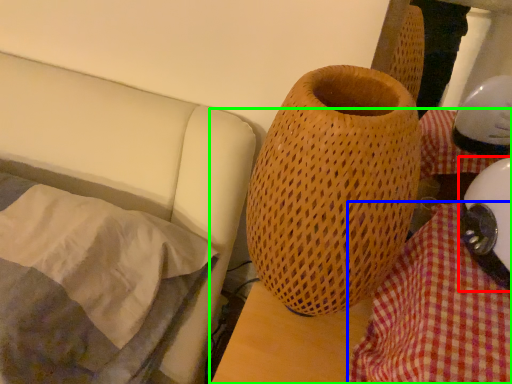
Question: Which object is positioned closest to helmet (highlighted by a red box)? Select from blanket (highlighted by a blue box) and table (highlighted by a green box).

Choices:
 (A) blanket
 (B) table

Answer: (A)